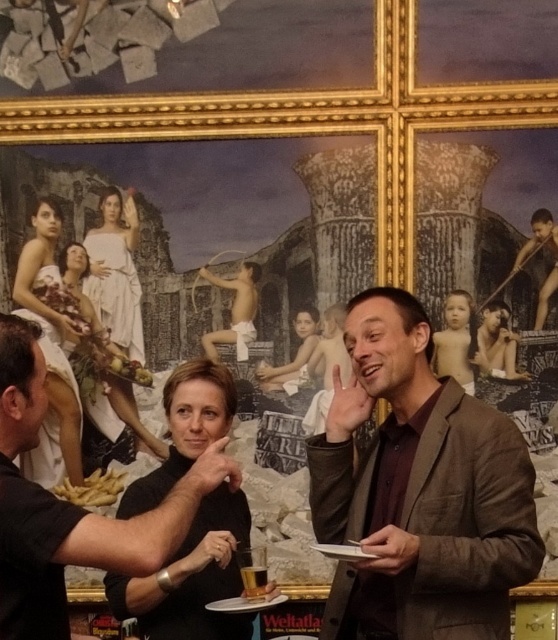
Question: Is white fabric dress at upper left bigger than white marble statue at upper center?

Choices:
 (A) no
 (B) yes

Answer: (B)

Question: Which object is positioned closest to the black matte shirt at center?

Choices:
 (A) brown textured blazer at center
 (B) white marble statue at upper center

Answer: (A)

Question: Can you confirm if brown textured blazer at center is positioned above white fabric dress at upper left?

Choices:
 (A) yes
 (B) no

Answer: (B)

Question: Which point is closer to the camera?

Choices:
 (A) (256, 566)
 (B) (57, 566)
 (C) (485, 577)
 (D) (79, 426)

Answer: (B)

Question: Does black matte shirt at center appear over translucent glass beer at center?

Choices:
 (A) no
 (B) yes

Answer: (B)

Question: Which of the following is the farthest from the observer?

Choices:
 (A) white fabric dress at upper left
 (B) translucent glass beer at center

Answer: (A)